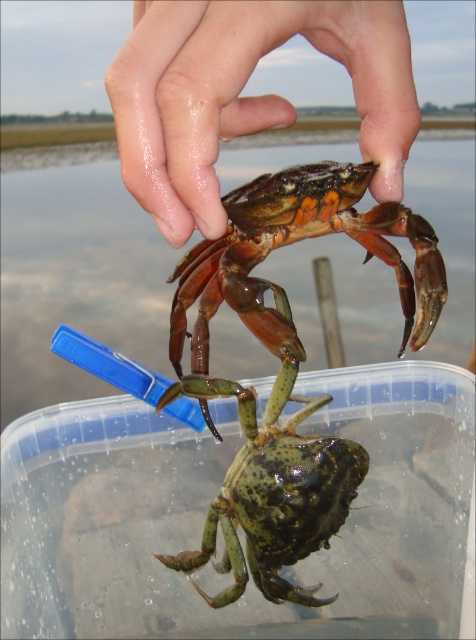
Describe the element at coordinates (246, 97) in the screenshot. This screenshot has height=640, width=476. I see `glossy skin hand at upper center` at that location.

In the scene shown: Is glossy skin hand at upper center smaller than shiny orange crab at upper center?

Yes, glossy skin hand at upper center is smaller than shiny orange crab at upper center.

What do you see at coordinates (246, 97) in the screenshot? The image size is (476, 640). I see `glossy skin hand at upper center` at bounding box center [246, 97].

Where is `glossy skin hand at upper center`? This screenshot has width=476, height=640. glossy skin hand at upper center is located at coordinates (246, 97).